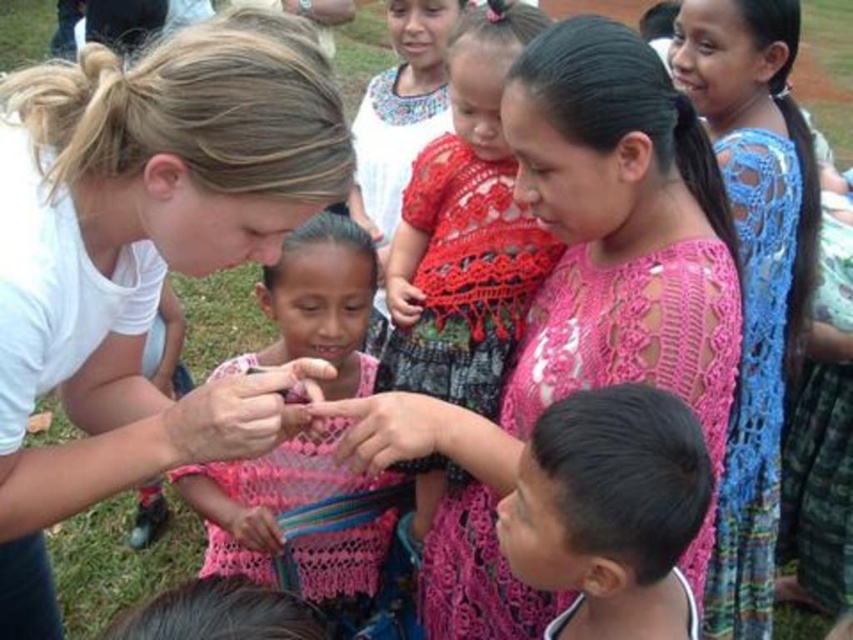
Question: Which object appears closest to the camera in this image?

Choices:
 (A) pink knitted sweater at center
 (B) white matte shirt at upper left
 (C) red crochet dress at center
 (D) blue crochet dress at upper right

Answer: (B)

Question: Can you confirm if white matte shirt at upper left is smaller than blue crochet dress at upper right?

Choices:
 (A) yes
 (B) no

Answer: (A)

Question: Is pink knitted sweater at center smaller than red crochet dress at center?

Choices:
 (A) yes
 (B) no

Answer: (A)

Question: Is white matte shirt at upper left to the right of blue crochet dress at upper right from the viewer's perspective?

Choices:
 (A) yes
 (B) no

Answer: (B)

Question: Which object is the farthest from the red crochet dress at center?

Choices:
 (A) white matte shirt at upper left
 (B) blue crochet dress at upper right

Answer: (B)

Question: Which of these objects is positioned closest to the red crochet dress at center?

Choices:
 (A) pink crochet dress at center
 (B) blue crochet dress at upper right
 (C) black lace hair at lower center

Answer: (A)